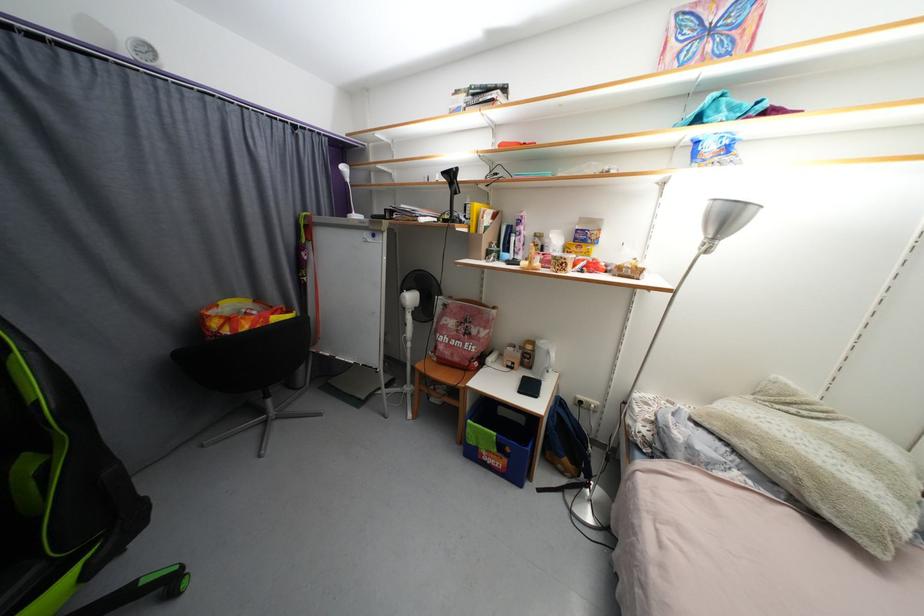
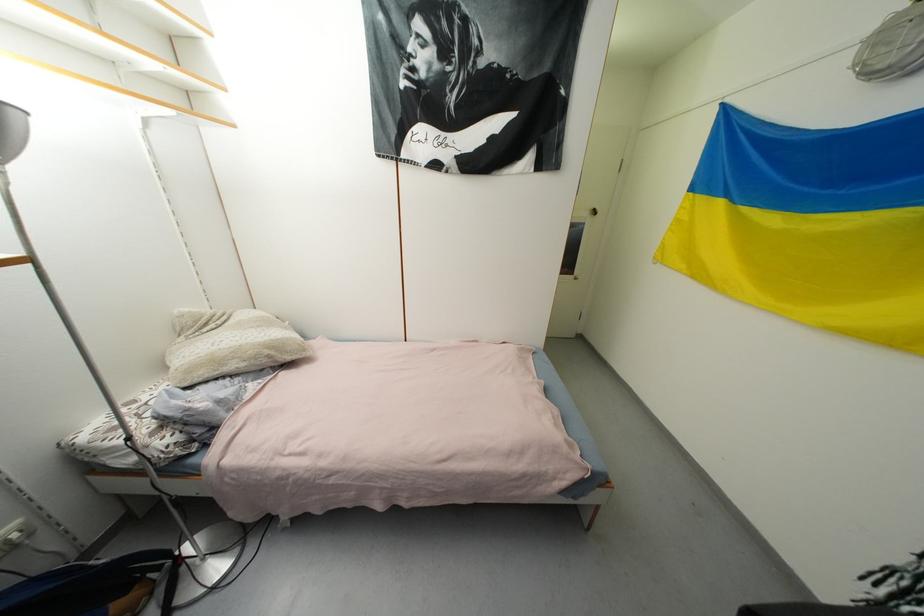
Locate, in the second image, the point that corresponds to pixel 785 466 in the first image.

(261, 359)